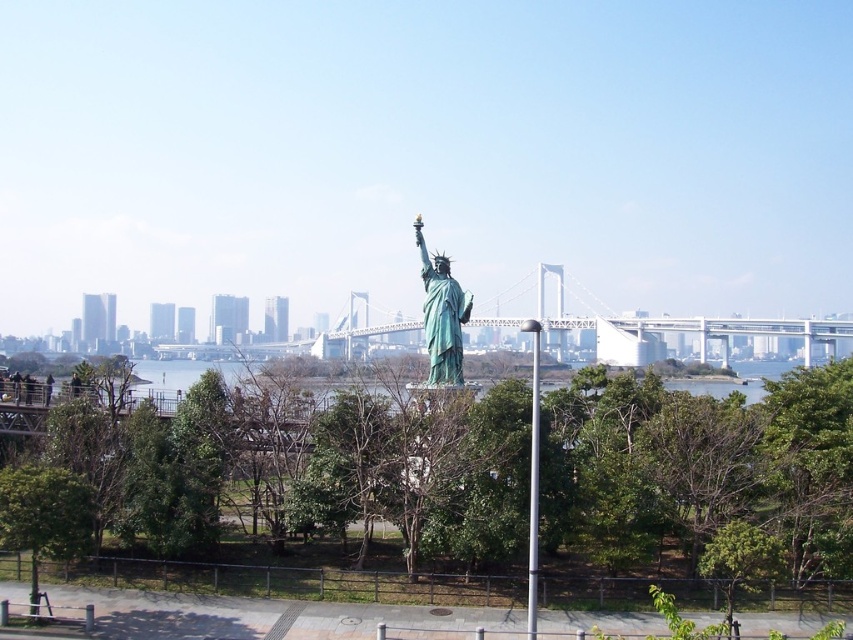
Does green leafy tree at center have a lesser height compared to green leafy tree at lower left?

No, green leafy tree at center is not shorter than green leafy tree at lower left.

In the scene shown: Between green leafy tree at center and green leafy tree at lower left, which one appears on the left side from the viewer's perspective?

→ Positioned to the left is green leafy tree at lower left.

Does point (94, 497) lie in front of point (65, 496)?

No.

At what (x,y) coordinates should I click in order to perform the action: click on green leafy tree at center. Please return your answer as a coordinate pair (x, y). Looking at the image, I should click on (309, 477).

Does green leafy tree at lower left appear under green polished metal statue at center?

Yes, green leafy tree at lower left is below green polished metal statue at center.

Is green leafy tree at lower left positioned before green polished metal statue at center?

Yes, green leafy tree at lower left is in front of green polished metal statue at center.

Describe the element at coordinates (44, 516) in the screenshot. I see `green leafy tree at lower left` at that location.

Locate an element on the screen. The image size is (853, 640). green leafy tree at lower left is located at coordinates (44, 516).

Where is `green polished metal statue at center`? Image resolution: width=853 pixels, height=640 pixels. green polished metal statue at center is located at coordinates (440, 314).

What do you see at coordinates (440, 314) in the screenshot? This screenshot has height=640, width=853. I see `green polished metal statue at center` at bounding box center [440, 314].

In order to click on green polished metal statue at center in this screenshot , I will do `click(440, 314)`.